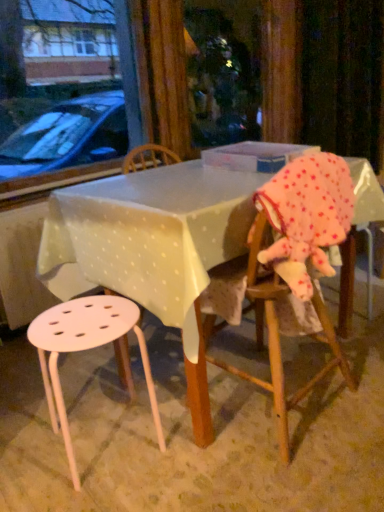
Question: From a real-world perspective, is translucent plastic box at center positioned above or below pink polka dot fabric at right?

Choices:
 (A) above
 (B) below

Answer: (A)

Question: Considering the positions of translucent plastic box at center and pink polka dot fabric at right in the image, is translucent plastic box at center taller or shorter than pink polka dot fabric at right?

Choices:
 (A) short
 (B) tall

Answer: (A)

Question: Which object is the closest to the white plastic table at center?

Choices:
 (A) translucent plastic box at center
 (B) pink polka dot fabric at right
 (C) white plastic stool at lower left
 (D) wooden chair at right

Answer: (C)

Question: Based on their relative distances, which object is farther from the white plastic stool at lower left?

Choices:
 (A) white plastic table at center
 (B) wooden chair at right
 (C) pink polka dot fabric at right
 (D) translucent plastic box at center

Answer: (D)